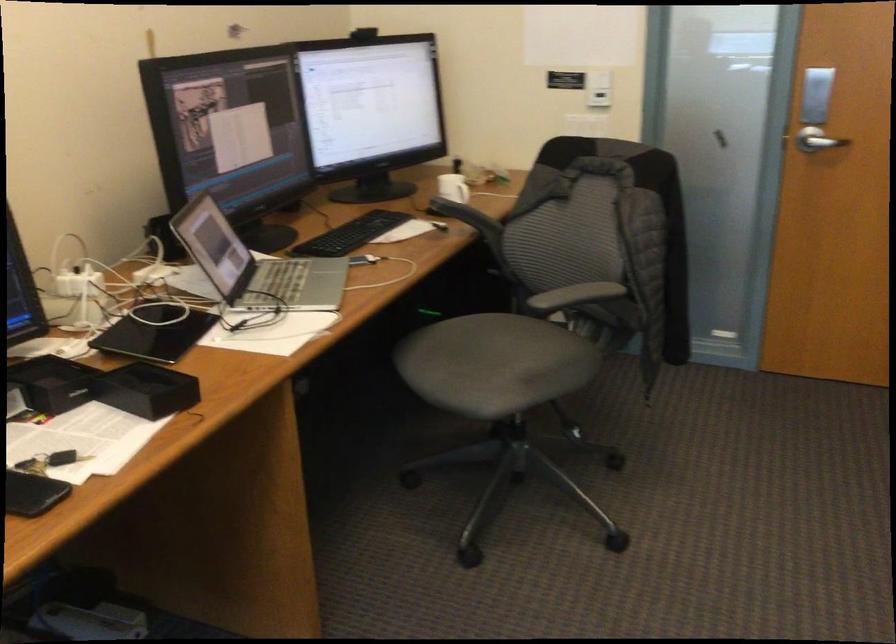
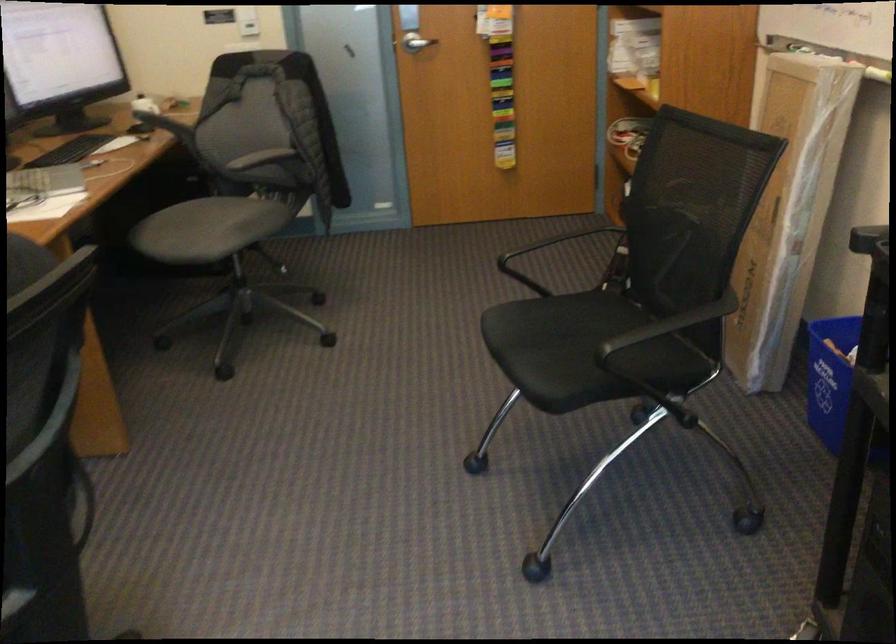
Find the pixel in the second image that matches [460,216] in the first image.

(158, 120)